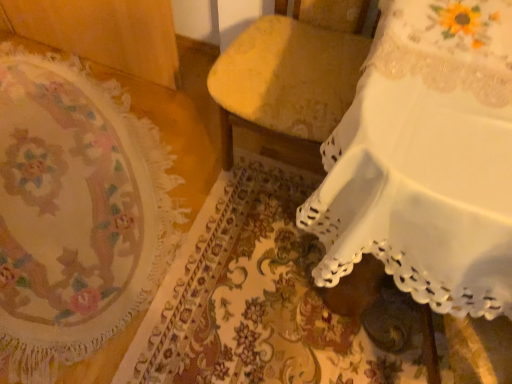
Where is `vacant space in velvet yellow chair at center, which ranks as the first furniture in left-to-right order (from a real-world perspective)`? This screenshot has width=512, height=384. vacant space in velvet yellow chair at center, which ranks as the first furniture in left-to-right order (from a real-world perspective) is located at coordinates (271, 166).